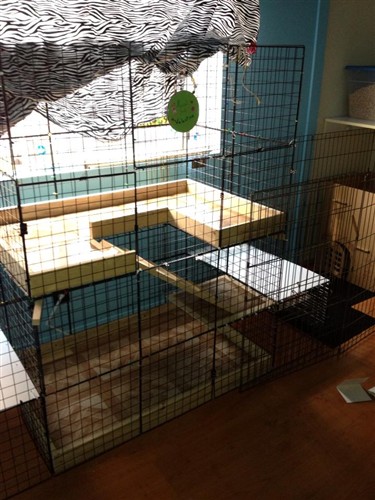
Where is `floor`? floor is located at coordinates (263, 443).